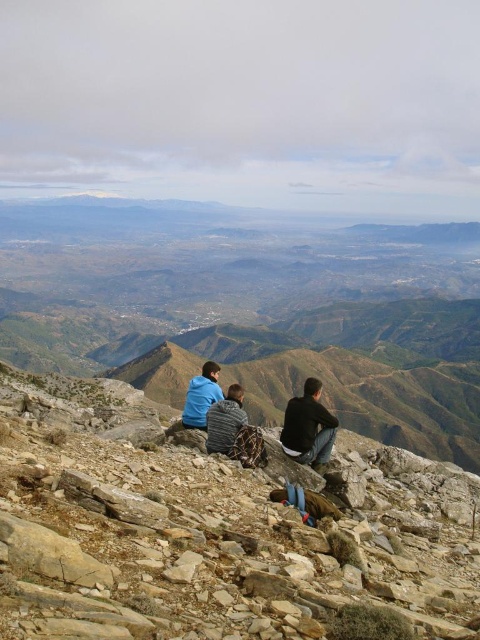
Is dark blue denim jacket at center to the left of dark blue shirt at center from the viewer's perspective?

Yes, dark blue denim jacket at center is to the left of dark blue shirt at center.

Which is behind, point (289, 432) or point (324, 456)?

The point (289, 432) is more distant.

Find the location of `dark blue denim jacket at center`. dark blue denim jacket at center is located at coordinates (309, 428).

Does brown rocky mountain at center have a lesser width compared to dark blue denim jacket at center?

No, brown rocky mountain at center is not thinner than dark blue denim jacket at center.

Does brown rocky mountain at center appear on the right side of dark blue denim jacket at center?

In fact, brown rocky mountain at center is to the left of dark blue denim jacket at center.

Between point (48, 520) and point (304, 401), which one is positioned behind?

The point (304, 401) is behind.

This screenshot has height=640, width=480. Identify the location of brown rocky mountain at center. (212, 531).

Does brown rocky mountain at center have a smaller size compared to blue fabric jacket at lower left?

Yes.

Does point (320, 483) come closer to viewer compared to point (204, 388)?

Yes.

What are the coordinates of `brown rocky mountain at center` in the screenshot? It's located at (212, 531).